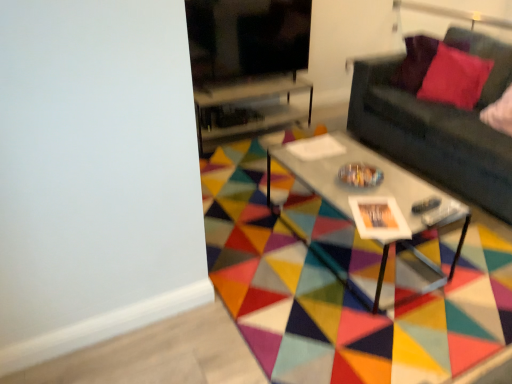
Question: Considering the relative sizes of transparent glass table at center and metallic gray coffee table at center in the image provided, is transparent glass table at center wider than metallic gray coffee table at center?

Choices:
 (A) yes
 (B) no

Answer: (B)

Question: Is transparent glass table at center bigger than metallic gray coffee table at center?

Choices:
 (A) yes
 (B) no

Answer: (B)

Question: Is metallic gray coffee table at center surrounded by transparent glass table at center?

Choices:
 (A) no
 (B) yes

Answer: (A)

Question: Is transparent glass table at center at the right side of metallic gray coffee table at center?

Choices:
 (A) no
 (B) yes

Answer: (A)

Question: Considering the relative sizes of transparent glass table at center and metallic gray coffee table at center in the image provided, is transparent glass table at center thinner than metallic gray coffee table at center?

Choices:
 (A) yes
 (B) no

Answer: (A)

Question: Is point (308, 122) positioned closer to the camera than point (316, 321)?

Choices:
 (A) farther
 (B) closer

Answer: (A)

Question: From a real-world perspective, is transparent glass table at center positioned above or below geometric multicolored rug at center?

Choices:
 (A) below
 (B) above

Answer: (B)

Question: From their relative heights in the image, would you say transparent glass table at center is taller or shorter than geometric multicolored rug at center?

Choices:
 (A) short
 (B) tall

Answer: (B)

Question: In the image, is transparent glass table at center on the left side or the right side of geometric multicolored rug at center?

Choices:
 (A) left
 (B) right

Answer: (A)

Question: In the image, is velvet red pillow at upper right positioned in front of or behind velvet red pillow at upper right?

Choices:
 (A) behind
 (B) front

Answer: (A)

Question: Is point (403, 59) positioned closer to the camera than point (445, 79)?

Choices:
 (A) closer
 (B) farther

Answer: (B)

Question: Looking at the image, does velvet red pillow at upper right seem bigger or smaller compared to velvet red pillow at upper right?

Choices:
 (A) small
 (B) big

Answer: (B)

Question: Is velvet red pillow at upper right situated inside velvet red pillow at upper right or outside?

Choices:
 (A) outside
 (B) inside

Answer: (A)

Question: From the image's perspective, relative to metallic gray coffee table at center, is geometric multicolored rug at center above or below?

Choices:
 (A) above
 (B) below

Answer: (B)

Question: From a real-world perspective, is geometric multicolored rug at center physically located above or below metallic gray coffee table at center?

Choices:
 (A) below
 (B) above

Answer: (A)